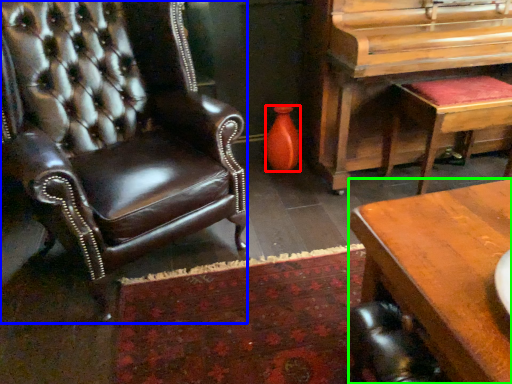
Question: Which is farther away from vase (highlighted by a red box)? chair (highlighted by a blue box) or desk (highlighted by a green box)?

Choices:
 (A) chair
 (B) desk

Answer: (B)